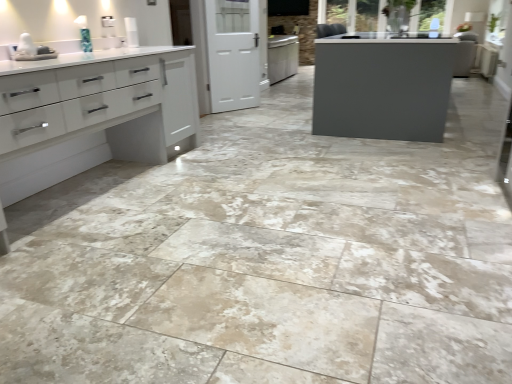
Question: Is white glossy sink at upper left not inside white glossy cabinet at left?

Choices:
 (A) yes
 (B) no

Answer: (B)

Question: Are white glossy sink at upper left and white glossy cabinet at left beside each other?

Choices:
 (A) yes
 (B) no

Answer: (B)

Question: Can you confirm if white glossy sink at upper left is shorter than white glossy cabinet at left?

Choices:
 (A) yes
 (B) no

Answer: (A)

Question: Is white glossy sink at upper left facing towards white glossy cabinet at left?

Choices:
 (A) yes
 (B) no

Answer: (A)

Question: Is white glossy cabinet at left a part of white glossy sink at upper left?

Choices:
 (A) no
 (B) yes

Answer: (A)

Question: Does white glossy sink at upper left appear on the right side of white glossy cabinet at left?

Choices:
 (A) no
 (B) yes

Answer: (A)

Question: From the image's perspective, is white matte screen door at center below white glossy cabinet at left?

Choices:
 (A) no
 (B) yes

Answer: (A)

Question: Does white matte screen door at center have a smaller size compared to white glossy cabinet at left?

Choices:
 (A) no
 (B) yes

Answer: (B)

Question: From a real-world perspective, is white matte screen door at center physically above white glossy cabinet at left?

Choices:
 (A) no
 (B) yes

Answer: (B)

Question: Considering the relative sizes of white matte screen door at center and white glossy cabinet at left in the image provided, is white matte screen door at center bigger than white glossy cabinet at left?

Choices:
 (A) yes
 (B) no

Answer: (B)

Question: Considering the relative sizes of white matte screen door at center and white glossy cabinet at left in the image provided, is white matte screen door at center wider than white glossy cabinet at left?

Choices:
 (A) yes
 (B) no

Answer: (B)

Question: From a real-world perspective, is white matte screen door at center located beneath white glossy cabinet at left?

Choices:
 (A) no
 (B) yes

Answer: (A)

Question: Is white matte screen door at center a part of white glossy cabinet at left?

Choices:
 (A) yes
 (B) no

Answer: (B)